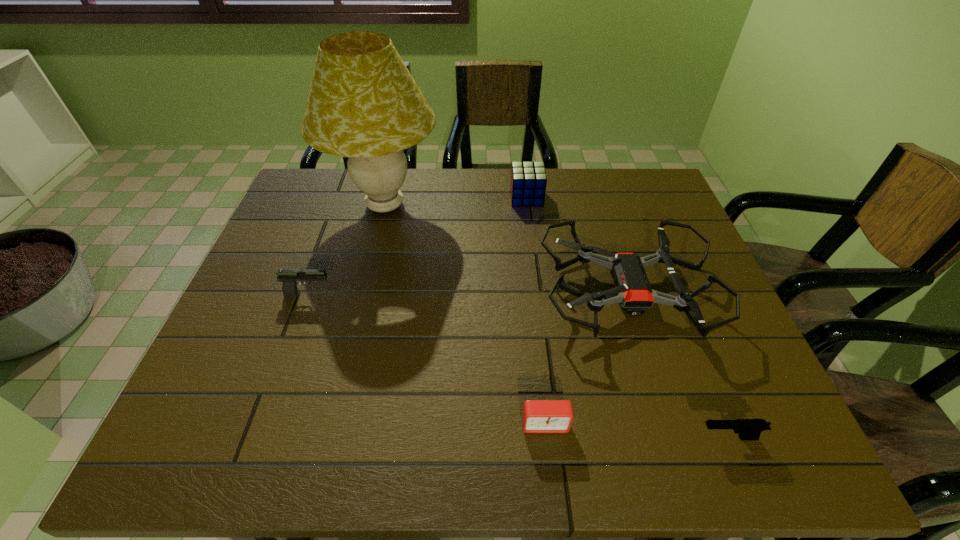
I want to click on pistol located in the near edge section of the desktop, so click(x=747, y=429).

Find the location of a particular element. The height and width of the screenshot is (540, 960). lampshade located at the left edge is located at coordinates (363, 103).

Identify the location of pistol positioned at the left edge. The height and width of the screenshot is (540, 960). (289, 278).

Locate an element on the screen. drone situated at the right edge is located at coordinates (632, 290).

Where is `pistol positioned at the right edge`? The height and width of the screenshot is (540, 960). pistol positioned at the right edge is located at coordinates (747, 429).

What are the coordinates of `object at the far left corner` in the screenshot? It's located at (363, 103).

What are the coordinates of `object that is at the near right corner` in the screenshot? It's located at (747, 429).

What are the coordinates of `vacant space at the far edge` in the screenshot? It's located at (457, 186).

The image size is (960, 540). What are the coordinates of `free spot at the near edge of the desktop` in the screenshot? It's located at (322, 430).

The image size is (960, 540). In the image, there is a desktop. Identify the location of vacant space at the left edge. (297, 298).